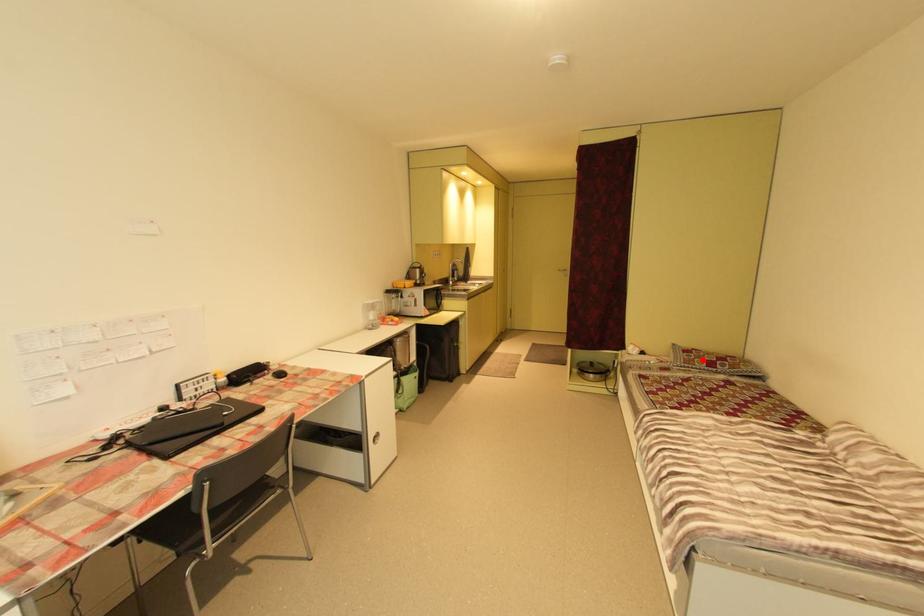
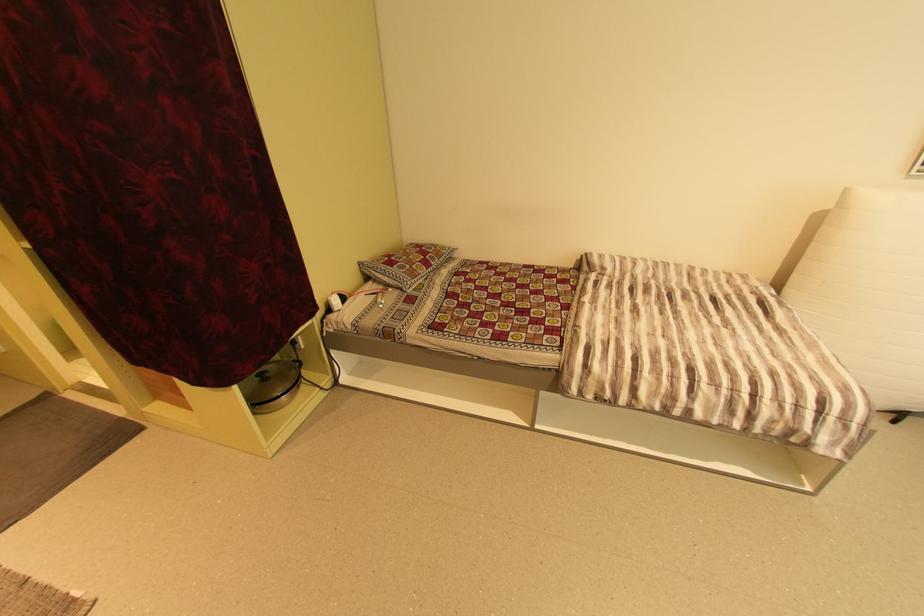
Question: I am providing you with two images of the same scene from different viewpoints. Image1 has a red point marked. In image2, the corresponding 3D location appears at what relative position? Reply with the corresponding letter.

Choices:
 (A) Closer
 (B) Farther

Answer: (A)